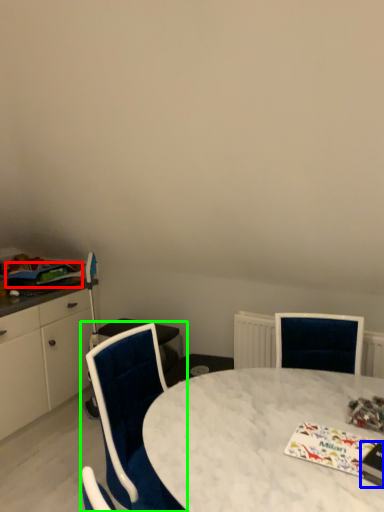
Question: Considering the real-world distances, which object is farthest from magazine (highlighted by a red box)? magazine (highlighted by a blue box) or chair (highlighted by a green box)?

Choices:
 (A) magazine
 (B) chair

Answer: (A)